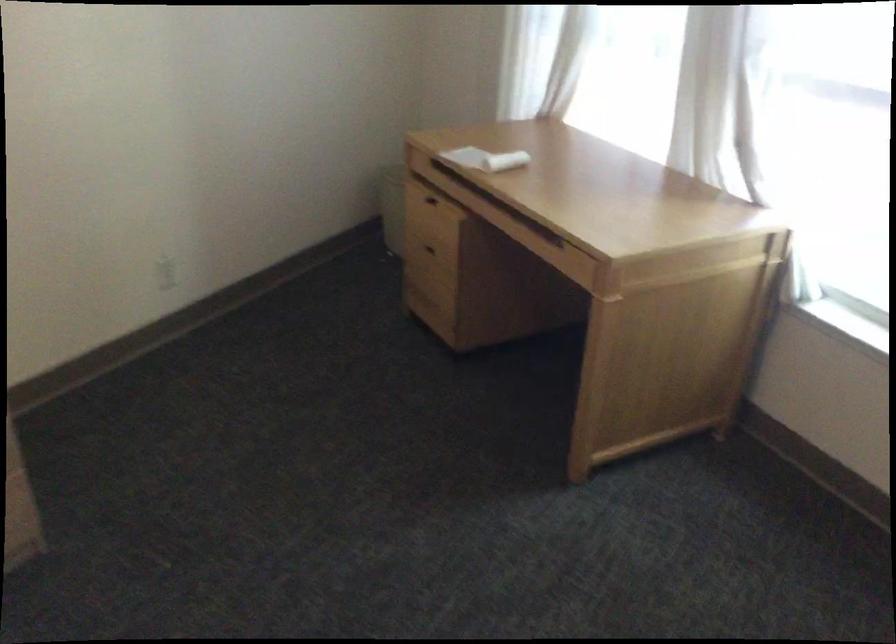
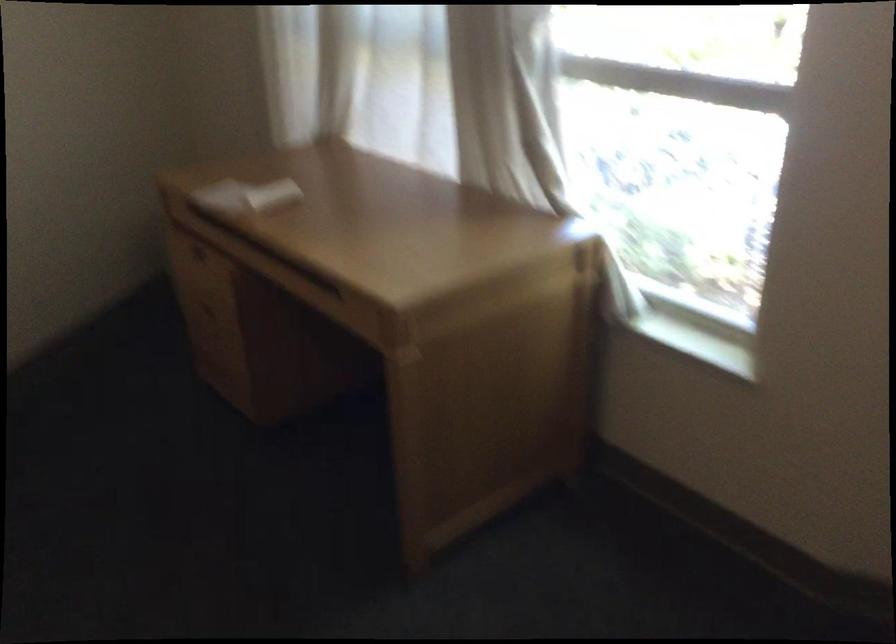
The images are taken continuously from a first-person perspective. In which direction are you moving?

The movement direction of the cameraman is right, forward.